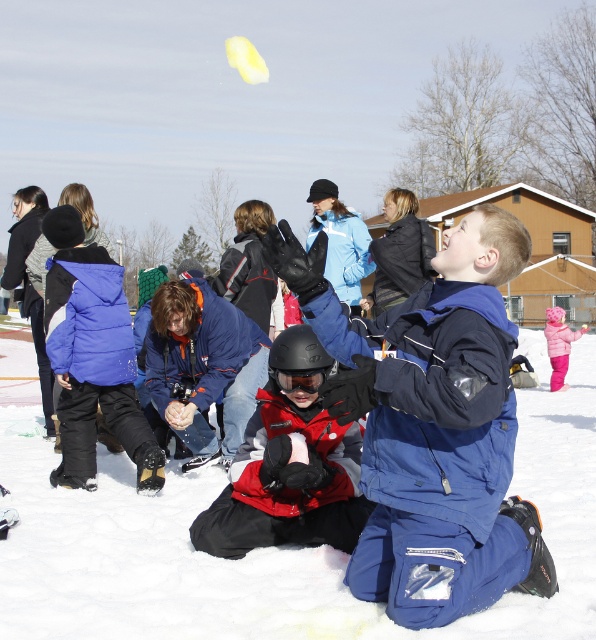
You are a photographer trying to capture a closeup of the blue softshell jacket at center and the red matte helmet at center. If your camera can only focus on objects within a 30 cm width, will both items fit in the frame?

The blue softshell jacket at center is larger than the red matte helmet at center. Since the camera can only focus on objects within a 30 cm width, and the blue softshell jacket at center is wider than the red matte helmet at center, it is possible that the blue softshell jacket at center may exceed the 30 cm width limit. Therefore, both items might not fit within the frame if the jacket is wider than 30 cm.

You are standing in the snowy area and want to take a photo of the two points in the scene. Which point, point (15, 541) or point (403, 371), will appear larger in your camera view?

Point (15, 541) will appear larger in the camera view because it is closer to the camera than point (403, 371).